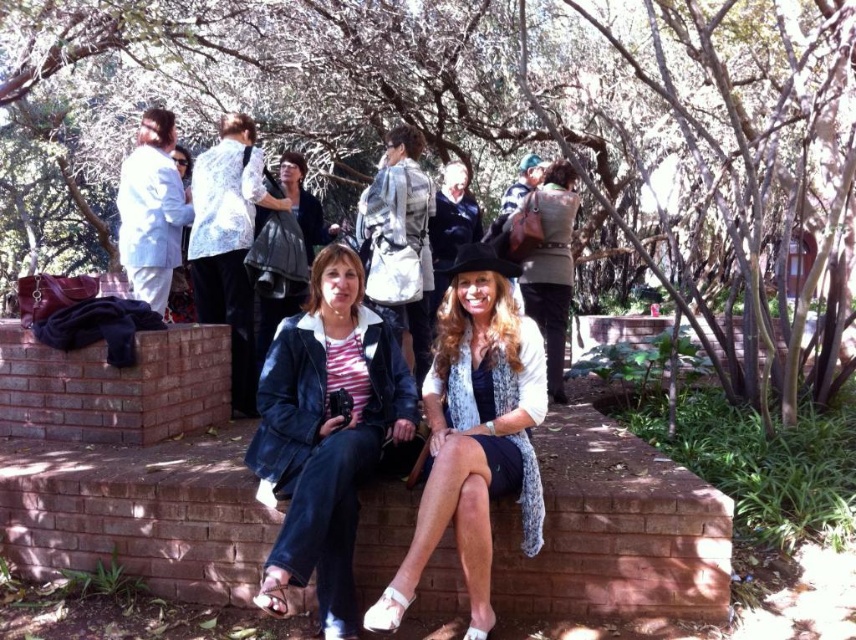
You are a photographer trying to capture a clear shot of the denim jacket at center without the green leafy tree at center blocking it. Based on their positions, is this possible?

The green leafy tree at center is above the denim jacket at center, so if you position yourself below the denim jacket at center or adjust the angle to avoid the tree, you can capture a clear shot without obstruction.

You are standing at the center of the park and want to take a photo of the green leafy tree at center. Which direction should you face to ensure the tree is in the frame?

Since the green leafy tree at center is located at point (480,129), you should face towards the coordinates provided to capture it in your photo.

Consider the image. You are a photographer trying to capture the scene of two women sitting on a brick wall. You notice the matte black hat at center and the dark gray fabric jacket at upper center. Which object is positioned lower in the image?

The matte black hat at center is located below the dark gray fabric jacket at upper center, so the matte black hat at center is positioned lower in the image.